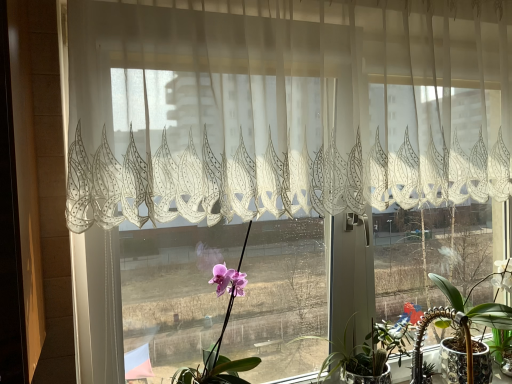
Question: Is green glossy succulent at lower right, the second houseplant positioned from the right, situated inside white glossy pot at lower right, the 1th houseplant in the right-to-left sequence, or outside?

Choices:
 (A) outside
 (B) inside

Answer: (A)

Question: Considering the relative positions of green glossy succulent at lower right, the second houseplant positioned from the right, and white glossy pot at lower right, marked as the third houseplant in a left-to-right arrangement, in the image provided, is green glossy succulent at lower right, the second houseplant positioned from the right, to the left or to the right of white glossy pot at lower right, marked as the third houseplant in a left-to-right arrangement,?

Choices:
 (A) left
 (B) right

Answer: (A)

Question: Which is farther from the translucent white lace curtain at upper center?

Choices:
 (A) green glossy succulent at lower right, the second houseplant positioned from the right
 (B) pink matte orchid at center, which ranks as the 1th houseplant in left-to-right order
 (C) white glossy pot at lower right, marked as the third houseplant in a left-to-right arrangement

Answer: (A)

Question: Which object is positioned farthest from the translucent white lace curtain at upper center?

Choices:
 (A) green glossy succulent at lower right, which ranks as the 2th houseplant in left-to-right order
 (B) white glossy pot at lower right, marked as the third houseplant in a left-to-right arrangement
 (C) pink matte orchid at center, which ranks as the 1th houseplant in left-to-right order

Answer: (A)